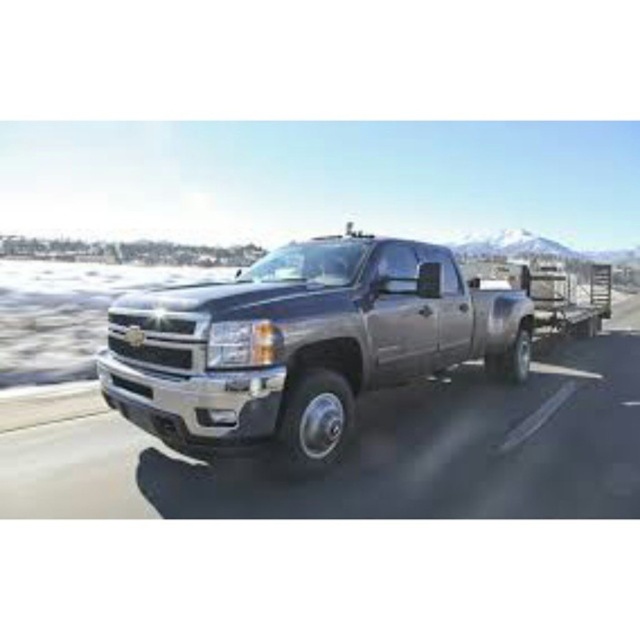
Who is lower down, metallic gray truck at center or satin metallic pickup truck at center?

metallic gray truck at center is lower down.

Looking at this image, does metallic gray truck at center appear on the right side of satin metallic pickup truck at center?

Yes, metallic gray truck at center is to the right of satin metallic pickup truck at center.

This screenshot has width=640, height=640. What do you see at coordinates (378, 452) in the screenshot?
I see `metallic gray truck at center` at bounding box center [378, 452].

Where is `metallic gray truck at center`? This screenshot has width=640, height=640. metallic gray truck at center is located at coordinates (378, 452).